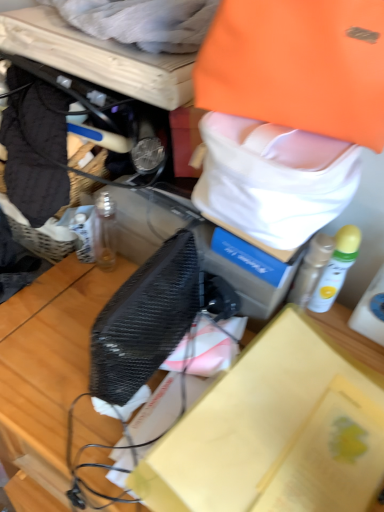
Locate an element on the screen. free spot in front of white matte bottle at upper right, which ranks as the 1th bottle in left-to-right order is located at coordinates (331, 426).